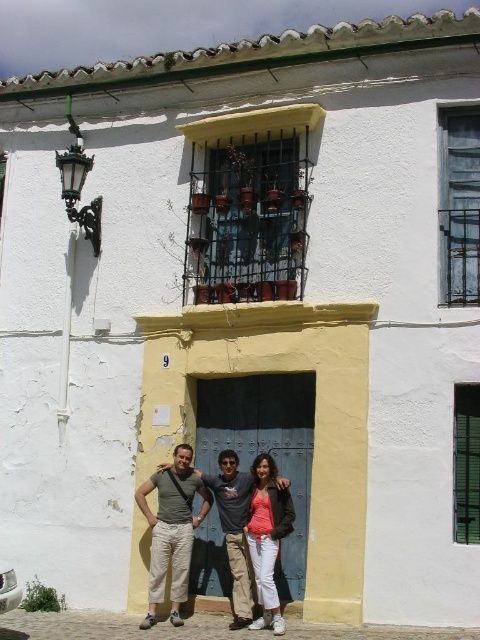
Question: Which object appears farthest from the camera in this image?

Choices:
 (A) beige cotton pants at center
 (B) matte gray pants at center

Answer: (B)

Question: Which point is closer to the camera?

Choices:
 (A) matte pink shirt at center
 (B) beige cotton pants at center
 (C) matte gray pants at center

Answer: (A)

Question: Is matte gray pants at center further to the viewer compared to beige cotton pants at center?

Choices:
 (A) yes
 (B) no

Answer: (A)

Question: Estimate the real-world distances between objects in this image. Which object is farther from the matte pink shirt at center?

Choices:
 (A) beige cotton pants at center
 (B) matte gray pants at center

Answer: (A)

Question: Considering the relative positions of beige cotton pants at center and matte pink shirt at center in the image provided, where is beige cotton pants at center located with respect to matte pink shirt at center?

Choices:
 (A) below
 (B) above

Answer: (A)

Question: Can you confirm if beige cotton pants at center is smaller than matte pink shirt at center?

Choices:
 (A) yes
 (B) no

Answer: (B)